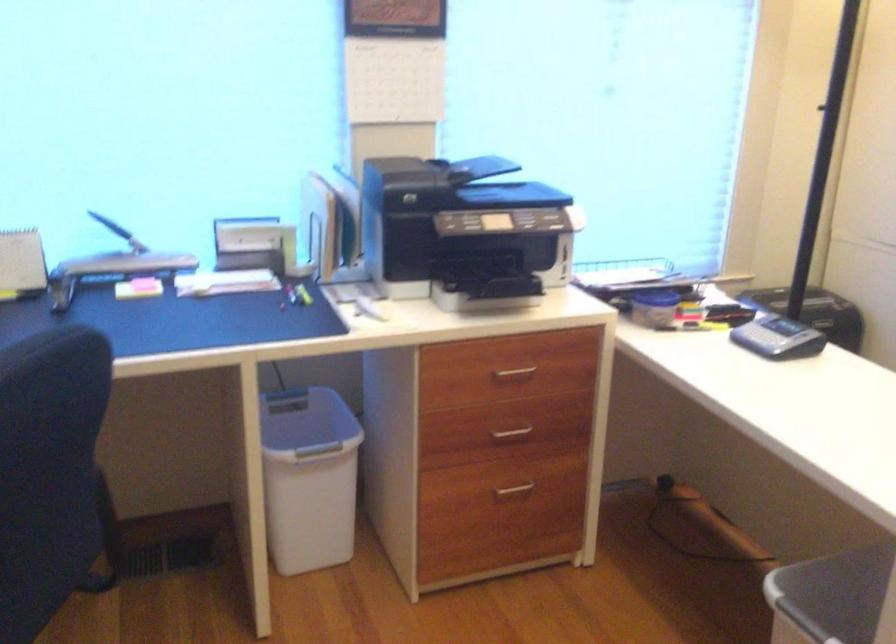
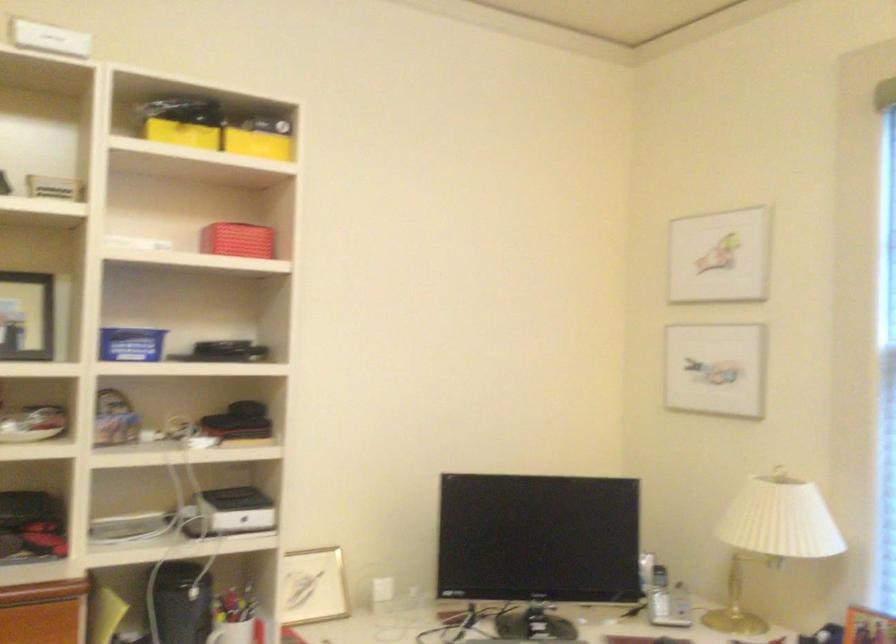
Question: Based on the continuous images, in which direction is the camera rotating? Reply with the corresponding letter.

Choices:
 (A) Left
 (B) Right
 (C) Up
 (D) Down

Answer: (A)